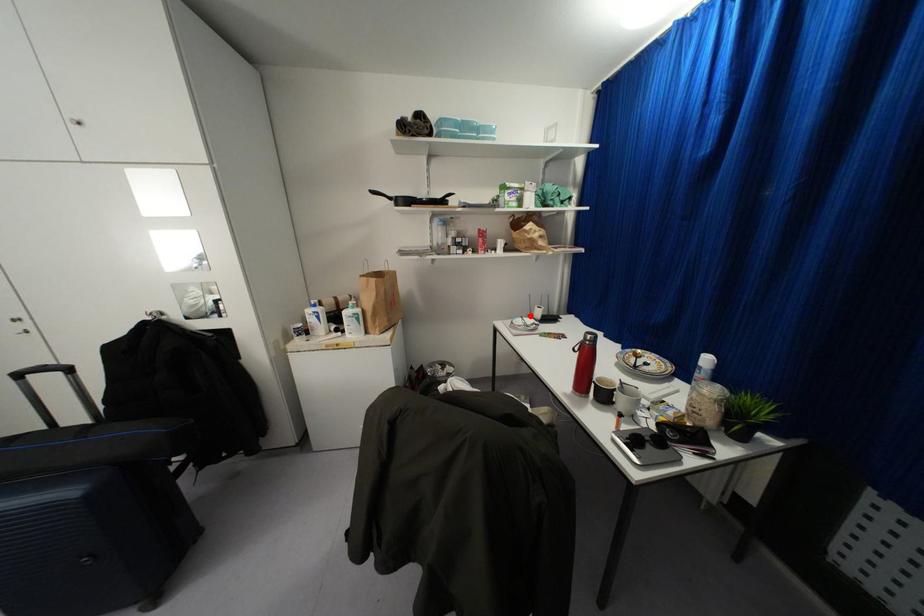
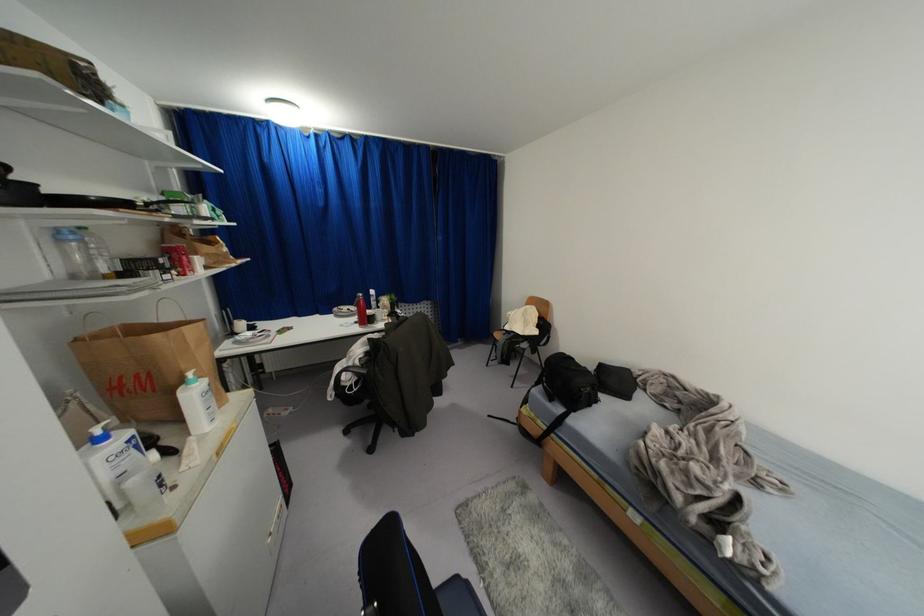
Find the pixel in the second image that matches the highlighted location in the first image.

(234, 333)